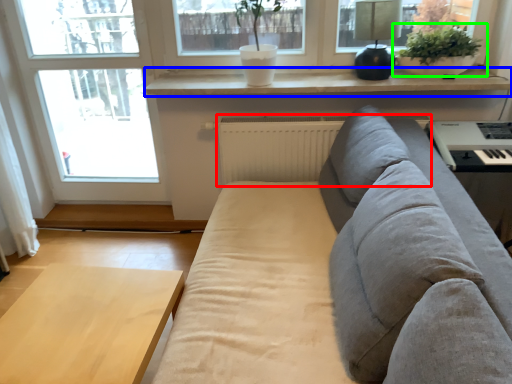
Question: Which object is the farthest from radiator (highlighted by a red box)? Choose among these: window sill (highlighted by a blue box) or houseplant (highlighted by a green box).

Choices:
 (A) window sill
 (B) houseplant

Answer: (B)